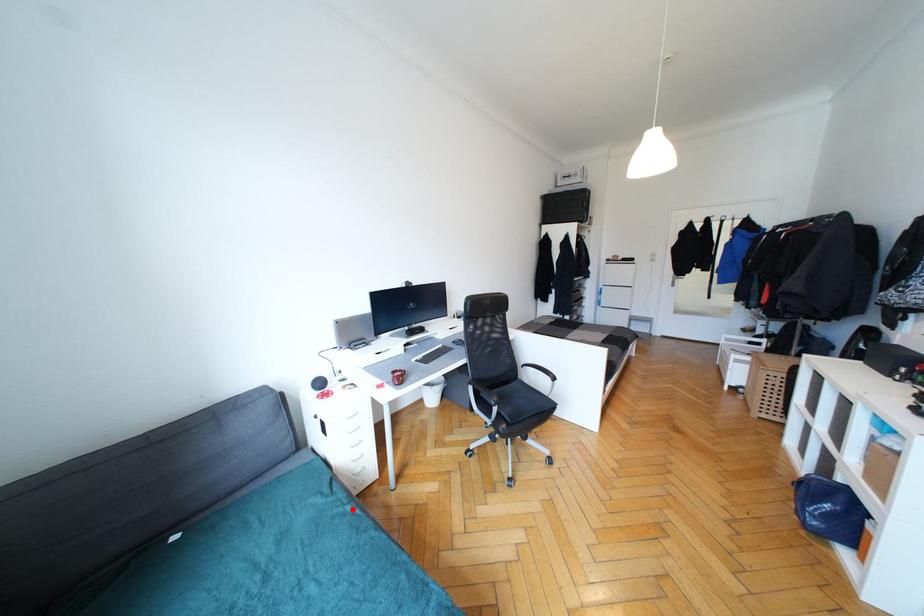
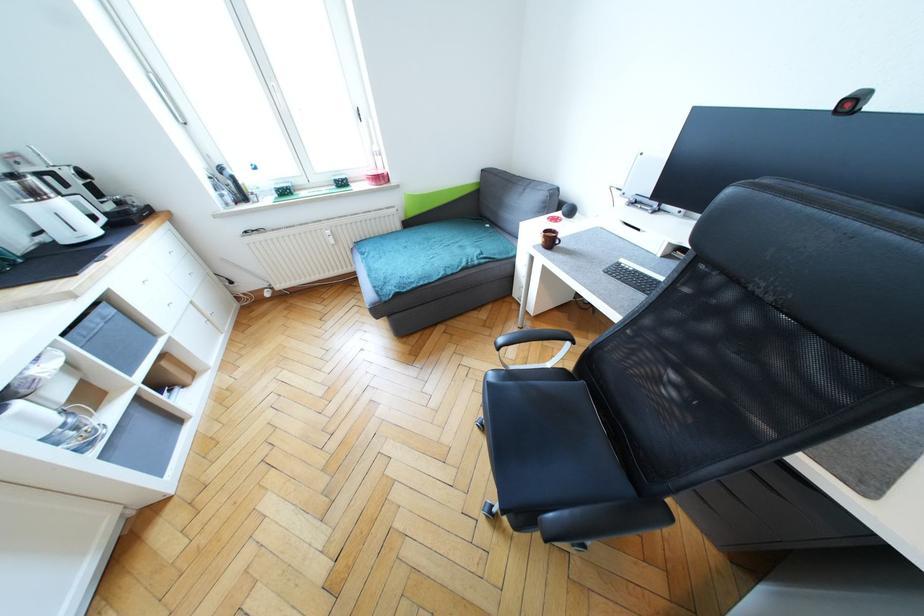
Question: I am providing you with two images of the same scene from different viewpoints. In image1, a red point is highlighted. Considering the same 3D point in image2, which of the following is correct?

Choices:
 (A) It is closer
 (B) It is farther

Answer: (B)